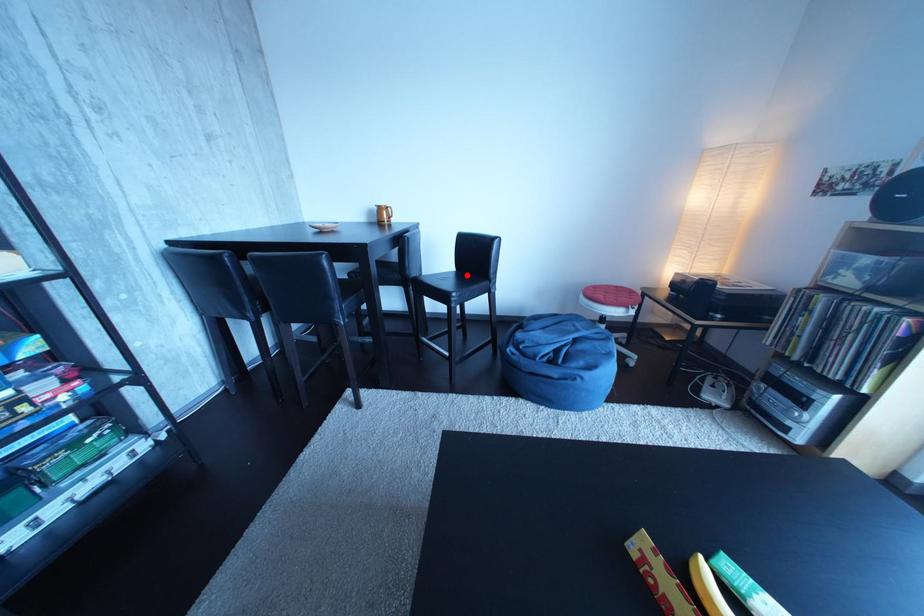
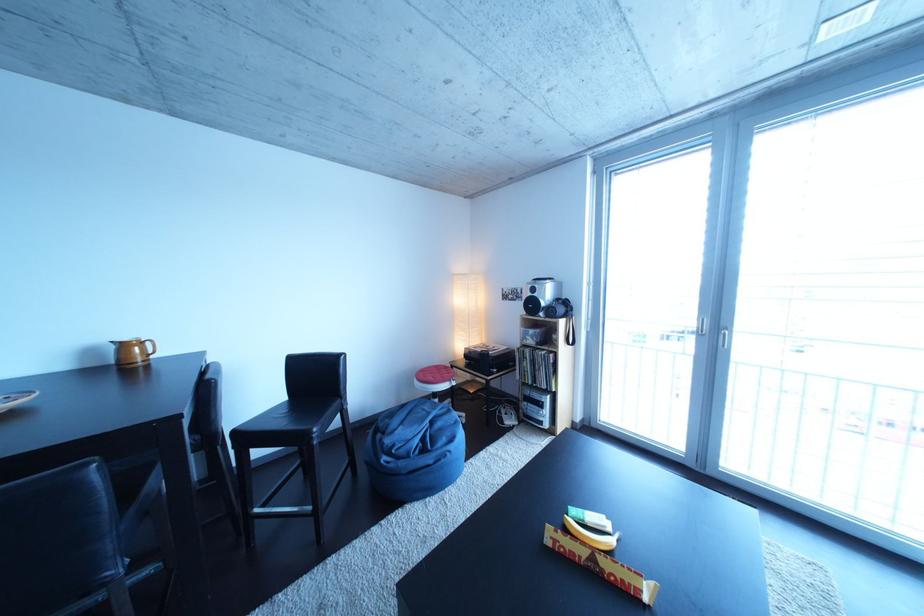
In the second image, find the point that corresponds to the highlighted location in the first image.

(299, 403)